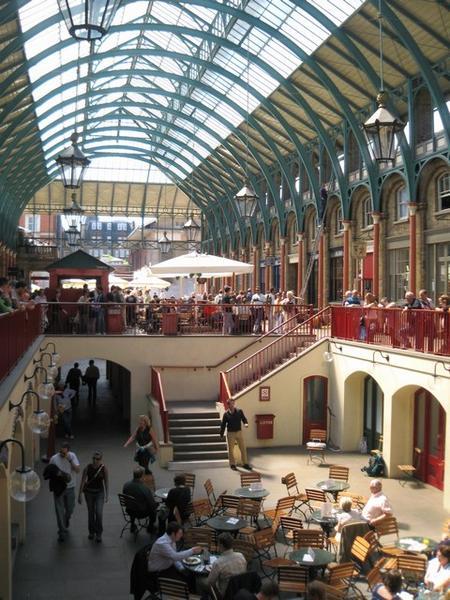
The width and height of the screenshot is (450, 600). I want to click on trash cans, so click(113, 322), click(169, 327), click(268, 425).